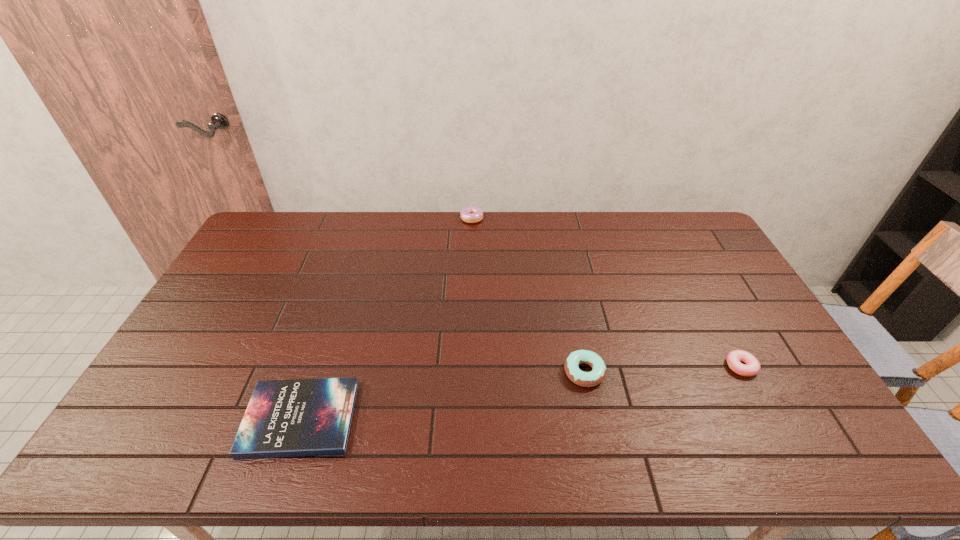
You are a GUI agent. You are given a task and a screenshot of the screen. Output one action in this format:
    pyautogui.click(x=<x>, y=<y>)
    Task: Click on the farthest object
    The image size is (960, 540).
    Given the screenshot: What is the action you would take?
    pyautogui.click(x=471, y=214)

I want to click on the leftmost doughnut, so click(x=471, y=214).

This screenshot has width=960, height=540. Identify the location of the third object from left to right. (587, 379).

You are a GUI agent. You are given a task and a screenshot of the screen. Output one action in this format:
    pyautogui.click(x=<x>, y=<y>)
    Task: Click on the rightmost doughnut
    The width and height of the screenshot is (960, 540).
    Given the screenshot: What is the action you would take?
    pyautogui.click(x=752, y=367)

Find the location of a particular element. The height and width of the screenshot is (540, 960). the rightmost object is located at coordinates (752, 367).

Locate an element on the screen. This screenshot has width=960, height=540. hardback book is located at coordinates (301, 417).

Locate an element on the screen. The width and height of the screenshot is (960, 540). the shortest object is located at coordinates (301, 417).

Image resolution: width=960 pixels, height=540 pixels. Identify the location of blank area located on the front of the farthest doughnut. (470, 268).

Find the location of `vacant space located on the right of the second object from right to left`. vacant space located on the right of the second object from right to left is located at coordinates (635, 372).

Identify the location of vacant area located on the right of the rightmost doughnut. (774, 366).